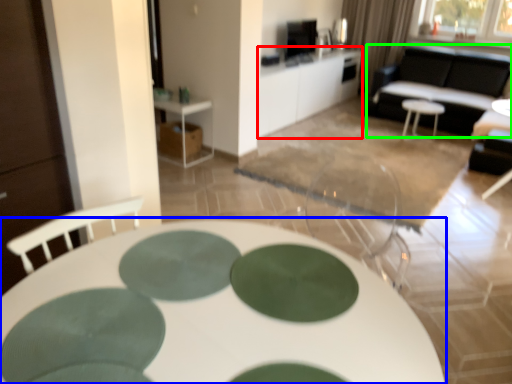
Question: Considering the real-world distances, which object is closest to table (highlighted by a red box)? table (highlighted by a blue box) or couch (highlighted by a green box).

Choices:
 (A) table
 (B) couch

Answer: (B)